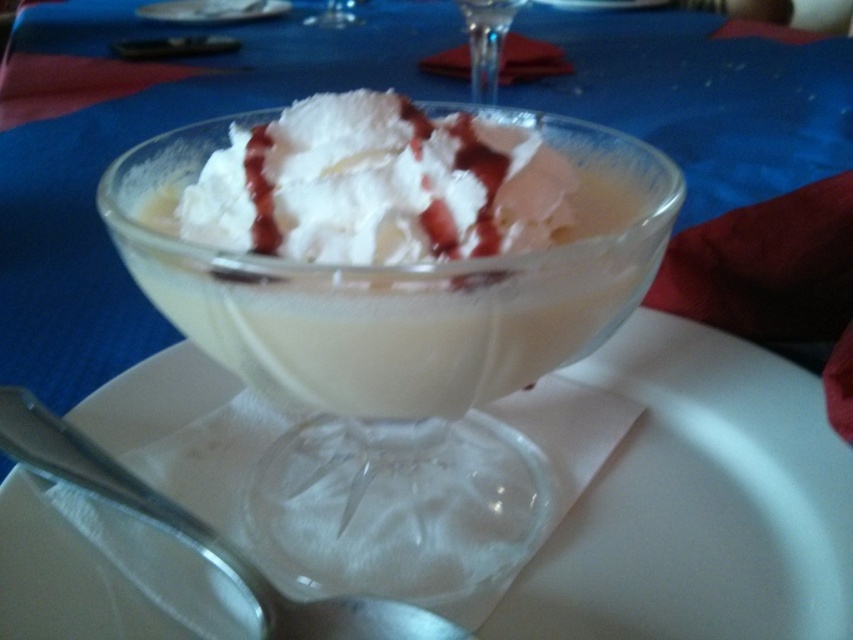
Looking at this image, can you confirm if silver metallic spoon at lower left is positioned to the left of transparent glass martini glass at center?

Correct, you'll find silver metallic spoon at lower left to the left of transparent glass martini glass at center.

Is silver metallic spoon at lower left wider than transparent glass martini glass at center?

Yes.

What do you see at coordinates (120, 492) in the screenshot? I see `silver metallic spoon at lower left` at bounding box center [120, 492].

This screenshot has width=853, height=640. Find the location of `silver metallic spoon at lower left`. silver metallic spoon at lower left is located at coordinates (120, 492).

Can you confirm if transparent glass at center is bigger than transparent glass martini glass at center?

Correct, transparent glass at center is larger in size than transparent glass martini glass at center.

Can you confirm if transparent glass at center is positioned to the left of transparent glass martini glass at center?

Correct, you'll find transparent glass at center to the left of transparent glass martini glass at center.

Describe the element at coordinates (393, 288) in the screenshot. I see `transparent glass at center` at that location.

You are a GUI agent. You are given a task and a screenshot of the screen. Output one action in this format:
    pyautogui.click(x=<x>, y=<y>)
    Task: Click on the transparent glass at center
    The width and height of the screenshot is (853, 640).
    Given the screenshot: What is the action you would take?
    pyautogui.click(x=393, y=288)

This screenshot has height=640, width=853. I want to click on white paper plate at center, so click(x=698, y=504).

Who is positioned more to the right, white paper plate at center or silver metallic spoon at lower left?

From the viewer's perspective, white paper plate at center appears more on the right side.

Where is `white paper plate at center`? white paper plate at center is located at coordinates (698, 504).

You are a GUI agent. You are given a task and a screenshot of the screen. Output one action in this format:
    pyautogui.click(x=<x>, y=<y>)
    Task: Click on the white paper plate at center
    This screenshot has width=853, height=640.
    Given the screenshot: What is the action you would take?
    pyautogui.click(x=698, y=504)